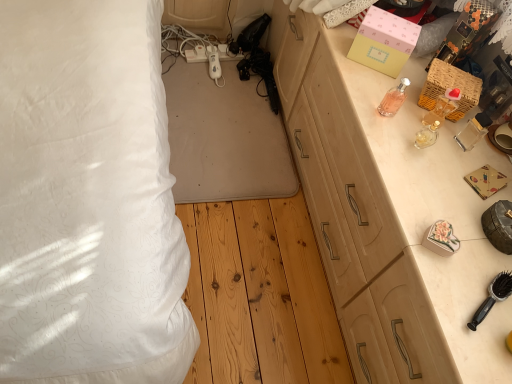
This screenshot has width=512, height=384. I want to click on free space that is in between translucent glass perfume at right, the second perfume from the left, and pink matte box at upper right, arranged as the 2th box when viewed from the right, so [383, 97].